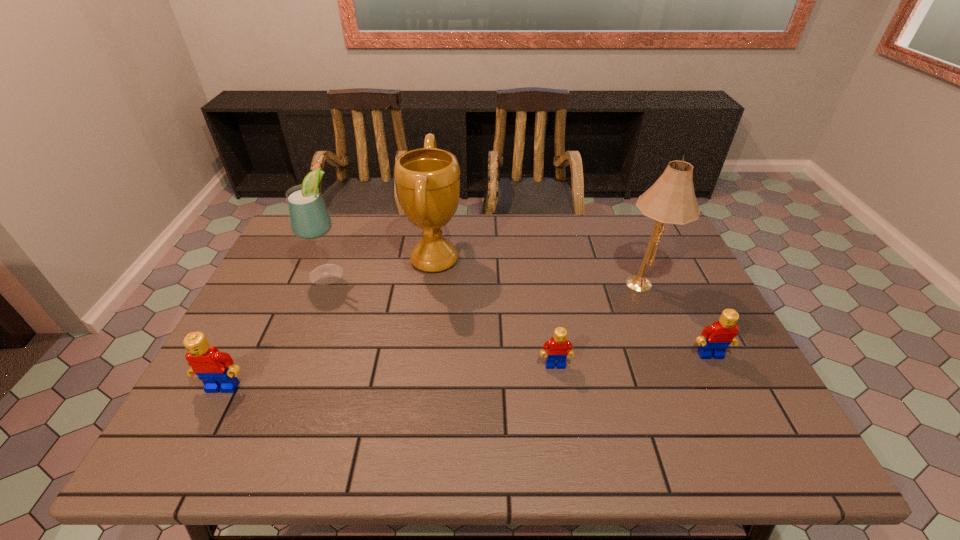
Find the location of a particular element. The width and height of the screenshot is (960, 540). lampshade situated at the right edge is located at coordinates (671, 199).

This screenshot has width=960, height=540. Identify the location of object present at the near left corner. (216, 369).

Where is `vacant region at the far edge`? Image resolution: width=960 pixels, height=540 pixels. vacant region at the far edge is located at coordinates (345, 227).

At what (x,y) coordinates should I click in order to perform the action: click on vacant space at the near edge of the desktop. Please return your answer as a coordinate pair (x, y). The width and height of the screenshot is (960, 540). Looking at the image, I should click on (669, 386).

This screenshot has height=540, width=960. Identify the location of vacant area at the right edge. (660, 272).

Identify the location of vacant space at the far right corner of the desktop. The height and width of the screenshot is (540, 960). (625, 237).

You are a GUI agent. You are given a task and a screenshot of the screen. Output one action in this format:
    pyautogui.click(x=<x>, y=<y>)
    Task: Click on the free space at the near right corner of the desktop
    
    Given the screenshot: What is the action you would take?
    pyautogui.click(x=744, y=395)

You are a GUI agent. You are given a task and a screenshot of the screen. Output one action in this format:
    pyautogui.click(x=<x>, y=<y>)
    Task: Click on the free space between the second Lego from right to left and the fifth object from right to left
    The image size is (960, 540).
    Given the screenshot: What is the action you would take?
    pyautogui.click(x=442, y=319)

At what (x,y) coordinates should I click in order to perform the action: click on free space between the leftmost object and the alcohol. Please return your answer as a coordinate pair (x, y). Looking at the image, I should click on (276, 330).

Identify the location of empty location between the fifth tallest object and the nearest Lego. (467, 371).